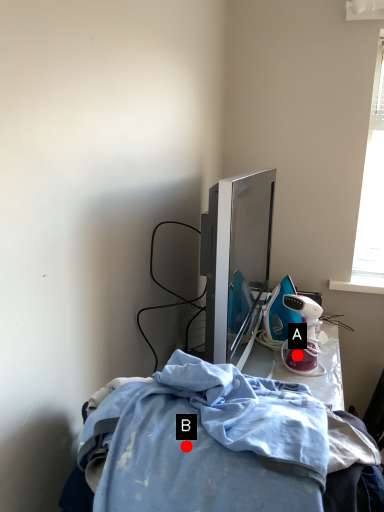
Question: Two points are circled on the image, labeled by A and B beside each circle. Among these points, which one is nearest to the camera?

Choices:
 (A) A is closer
 (B) B is closer

Answer: (B)